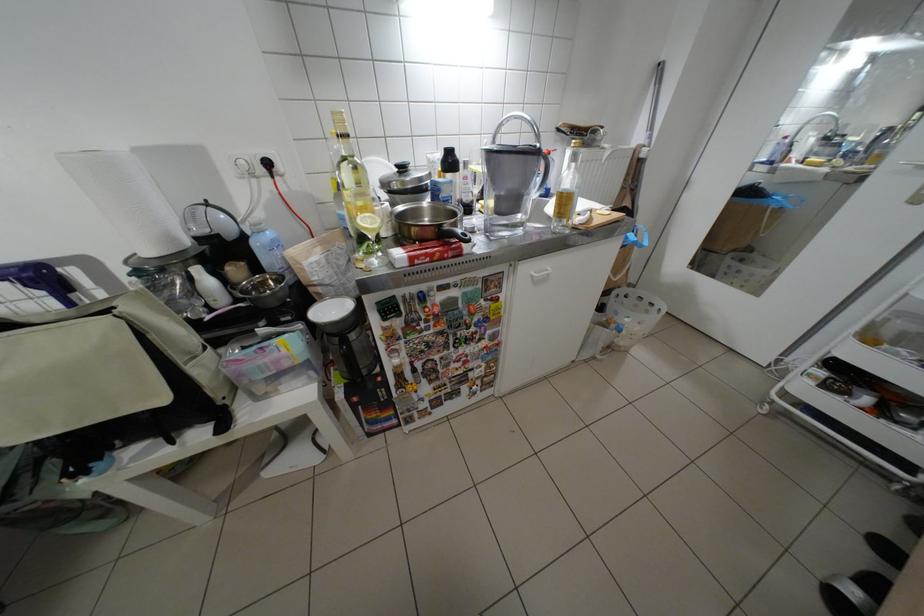
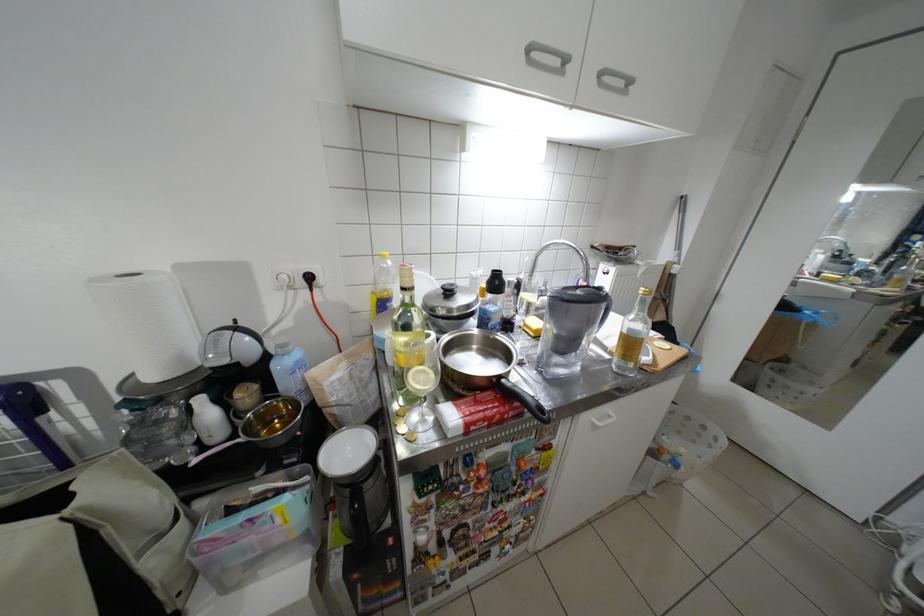
Locate, in the second image, the point that corresponds to pixel 268 245 in the first image.

(287, 367)